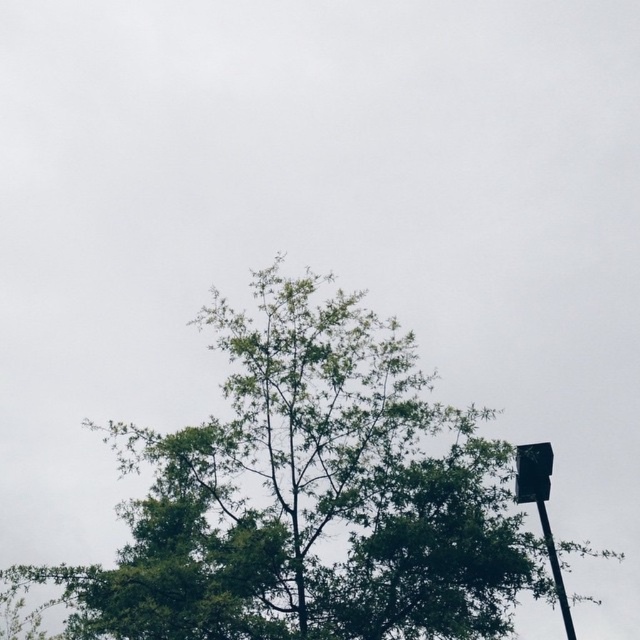
Question: Which point is closer to the camera?

Choices:
 (A) metallic black traffic light at right
 (B) metallic street sign at right
 (C) green leafy tree at upper center
 (D) metallic pole at upper right

Answer: (C)

Question: Does metallic street sign at right appear on the right side of metallic black traffic light at right?

Choices:
 (A) yes
 (B) no

Answer: (A)

Question: In this image, where is green leafy tree at upper center located relative to metallic pole at upper right?

Choices:
 (A) below
 (B) above

Answer: (B)

Question: Which of the following is the closest to the observer?

Choices:
 (A) metallic black traffic light at right
 (B) green leafy tree at upper center

Answer: (B)

Question: Which is farther from the metallic street sign at right?

Choices:
 (A) metallic black traffic light at right
 (B) green leafy tree at upper center
 (C) metallic pole at upper right

Answer: (B)

Question: Is green leafy tree at upper center smaller than metallic pole at upper right?

Choices:
 (A) yes
 (B) no

Answer: (B)